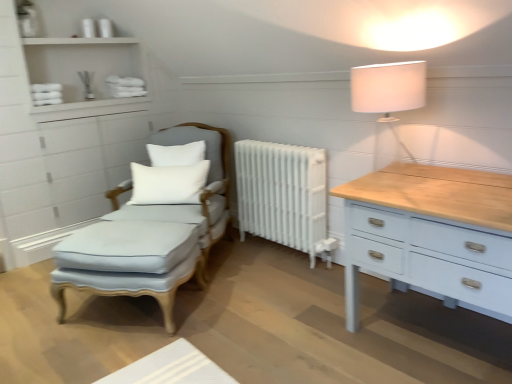
Question: Is white soft cushion at center, positioned as the second pillow in top-to-bottom order, aimed at white painted radiator at center?

Choices:
 (A) yes
 (B) no

Answer: (B)

Question: From the image's perspective, does white soft cushion at center, which is the first pillow in bottom-to-top order, appear higher than white painted radiator at center?

Choices:
 (A) yes
 (B) no

Answer: (A)

Question: Is white soft cushion at center, which is the first pillow in bottom-to-top order, thinner than white painted radiator at center?

Choices:
 (A) no
 (B) yes

Answer: (B)

Question: Considering the relative sizes of white soft cushion at center, positioned as the second pillow in top-to-bottom order, and white painted radiator at center in the image provided, is white soft cushion at center, positioned as the second pillow in top-to-bottom order, taller than white painted radiator at center?

Choices:
 (A) no
 (B) yes

Answer: (A)

Question: Would you say white soft cushion at center, positioned as the second pillow in top-to-bottom order, contains white painted radiator at center?

Choices:
 (A) no
 (B) yes

Answer: (A)

Question: Can you see white soft cushion at center, positioned as the second pillow in top-to-bottom order, touching white painted radiator at center?

Choices:
 (A) yes
 (B) no

Answer: (B)

Question: Considering the relative sizes of light blue fabric footrest at center and white soft cushion at center, positioned as the second pillow in top-to-bottom order, in the image provided, is light blue fabric footrest at center bigger than white soft cushion at center, positioned as the second pillow in top-to-bottom order,?

Choices:
 (A) no
 (B) yes

Answer: (B)

Question: From the image's perspective, is light blue fabric footrest at center beneath white soft cushion at center, positioned as the second pillow in top-to-bottom order?

Choices:
 (A) no
 (B) yes

Answer: (B)

Question: Is light blue fabric footrest at center further to the viewer compared to white soft cushion at center, which is the first pillow in bottom-to-top order?

Choices:
 (A) yes
 (B) no

Answer: (B)

Question: Is light blue fabric footrest at center facing towards white soft cushion at center, which is the first pillow in bottom-to-top order?

Choices:
 (A) no
 (B) yes

Answer: (A)

Question: Considering the relative sizes of light blue fabric footrest at center and white soft cushion at center, which is the first pillow in bottom-to-top order, in the image provided, is light blue fabric footrest at center taller than white soft cushion at center, which is the first pillow in bottom-to-top order,?

Choices:
 (A) yes
 (B) no

Answer: (A)

Question: Does light blue fabric footrest at center have a lesser width compared to white soft cushion at center, which is the first pillow in bottom-to-top order?

Choices:
 (A) no
 (B) yes

Answer: (A)

Question: Does white fabric lampshade at upper right have a lesser width compared to white painted radiator at center?

Choices:
 (A) yes
 (B) no

Answer: (B)